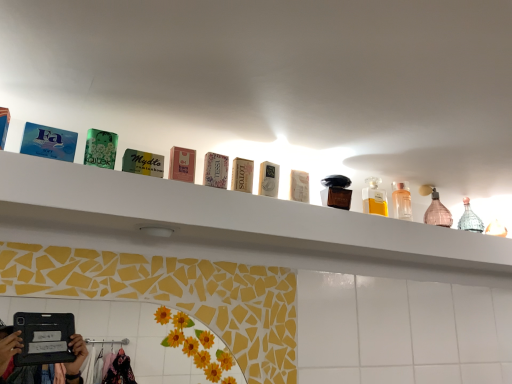
Question: Is clear glass bottle at upper right, the 1th toiletry in the right-to-left sequence, to the right of pink glass bottle at upper right, which appears as the first mouthwash when viewed from the back, from the viewer's perspective?

Choices:
 (A) no
 (B) yes

Answer: (A)

Question: From the image's perspective, is clear glass bottle at upper right, the third toiletry in the left-to-right sequence, located above pink glass bottle at upper right, which appears as the first mouthwash when viewed from the back?

Choices:
 (A) yes
 (B) no

Answer: (A)

Question: Is the position of clear glass bottle at upper right, the 3th toiletry in the front-to-back sequence, more distant than that of pink glass bottle at upper right, marked as the 2th mouthwash in a front-to-back arrangement?

Choices:
 (A) no
 (B) yes

Answer: (A)

Question: Does clear glass bottle at upper right, positioned as the 1th toiletry in back-to-front order, have a lesser width compared to pink glass bottle at upper right, marked as the first mouthwash in a right-to-left arrangement?

Choices:
 (A) yes
 (B) no

Answer: (A)

Question: From the image's perspective, is clear glass bottle at upper right, positioned as the 1th toiletry in back-to-front order, located beneath pink glass bottle at upper right, which appears as the first mouthwash when viewed from the back?

Choices:
 (A) yes
 (B) no

Answer: (B)

Question: Is pink glass bottle at upper right, marked as the first mouthwash in a right-to-left arrangement, wider or thinner than white cardboard box at center?

Choices:
 (A) thin
 (B) wide

Answer: (B)

Question: From a real-world perspective, is pink glass bottle at upper right, which appears as the first mouthwash when viewed from the back, physically located above or below white cardboard box at center?

Choices:
 (A) below
 (B) above

Answer: (B)

Question: In terms of height, does pink glass bottle at upper right, which appears as the first mouthwash when viewed from the back, look taller or shorter compared to white cardboard box at center?

Choices:
 (A) tall
 (B) short

Answer: (A)

Question: Is pink glass bottle at upper right, marked as the first mouthwash in a right-to-left arrangement, situated inside white cardboard box at center or outside?

Choices:
 (A) inside
 (B) outside

Answer: (B)

Question: Is matte pink soap at center, acting as the first toiletry starting from the front, inside the boundaries of white cardboard box at center, or outside?

Choices:
 (A) outside
 (B) inside

Answer: (A)

Question: Considering the positions of matte pink soap at center, acting as the first toiletry starting from the front, and white cardboard box at center in the image, is matte pink soap at center, acting as the first toiletry starting from the front, bigger or smaller than white cardboard box at center?

Choices:
 (A) small
 (B) big

Answer: (A)

Question: From their relative heights in the image, would you say matte pink soap at center, acting as the first toiletry starting from the front, is taller or shorter than white cardboard box at center?

Choices:
 (A) tall
 (B) short

Answer: (B)

Question: From a real-world perspective, is matte pink soap at center, which is counted as the third toiletry, starting from the right, positioned above or below white cardboard box at center?

Choices:
 (A) above
 (B) below

Answer: (B)

Question: Visually, is shiny brown perfume at center, the second toiletry viewed from the back, positioned to the left or to the right of white glossy shelf at upper center?

Choices:
 (A) left
 (B) right

Answer: (A)

Question: In terms of width, does shiny brown perfume at center, the 2th toiletry from the left, look wider or thinner when compared to white glossy shelf at upper center?

Choices:
 (A) thin
 (B) wide

Answer: (A)